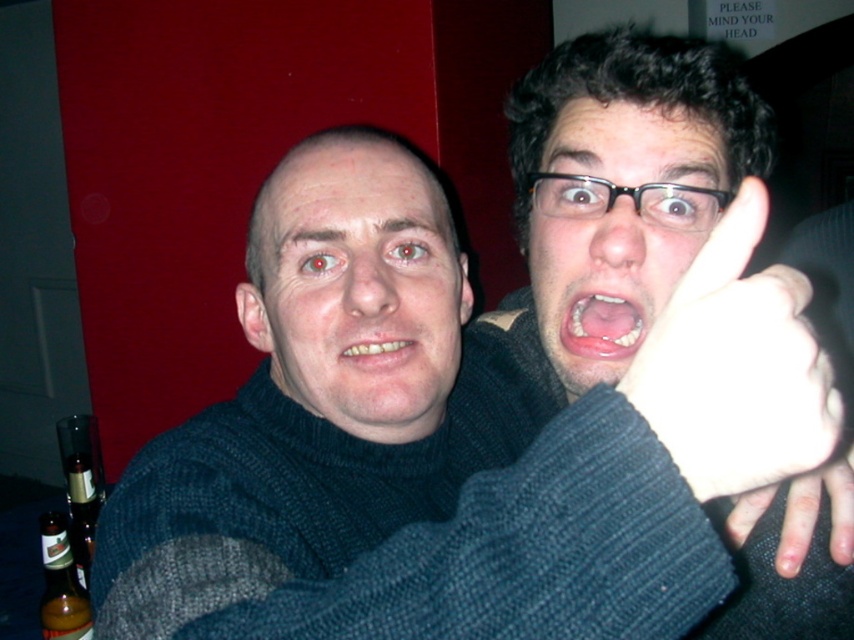
Question: Does matte black face at center have a greater width compared to matte black glasses at upper right?

Choices:
 (A) no
 (B) yes

Answer: (B)

Question: Which object is the closest to the white matte hand at center?

Choices:
 (A) yellowish matte teeth at center
 (B) matte black face at center
 (C) amber glass bottle at lower left

Answer: (A)

Question: From the image, what is the correct spatial relationship of matte black face at center in relation to white matte hand at center?

Choices:
 (A) right
 (B) left

Answer: (B)

Question: Which point is closer to the camera?

Choices:
 (A) pink glossy lips at center
 (B) dark blue sweater at center
 (C) matte black glasses at upper right
 (D) smooth skin hand at center

Answer: (B)

Question: Is matte black glasses at upper right positioned at the back of yellowish matte teeth at center?

Choices:
 (A) no
 (B) yes

Answer: (A)

Question: Which point appears closest to the camera in this image?

Choices:
 (A) (753, 524)
 (B) (512, 483)
 (C) (743, 195)

Answer: (B)